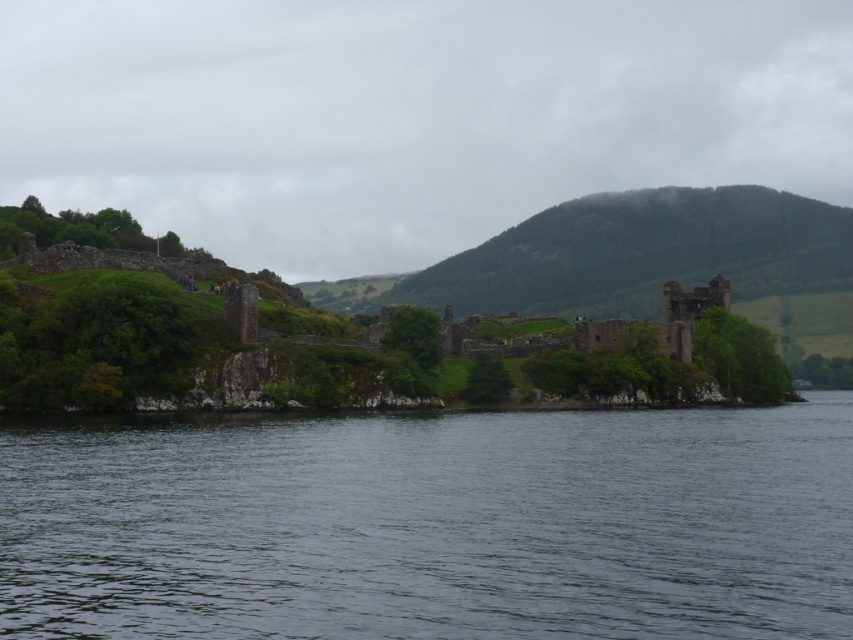
You are standing on the island with the historic castle and want to cross to the mainland. You see a point marked as point (431, 524) in the image. Is this point part of the transparent water at center?

The transparent water at center is represented by point (431, 524), so yes, this point is part of the transparent water at center.

You are a tourist standing on the island with the castle. You want to take a photo that includes both the transparent water at center and the rusty stone castle at center. Which object should be placed closer to the camera to ensure both are in focus?

To ensure both the transparent water at center and the rusty stone castle at center are in focus, you should place the transparent water at center closer to the camera since it has a lesser height compared to the rusty stone castle at center. This way, the depth of field will cover both objects effectively.

You are a hiker planning to visit the historic site. You want to take a photo that captures both the green grassy hill at center and the rusty stone castle at center. Which object should you position closer to the foreground to ensure both are in focus?

Since the green grassy hill at center is taller than the rusty stone castle at center, positioning the green grassy hill at center closer to the foreground will help ensure both are in focus by reducing the depth of field required.